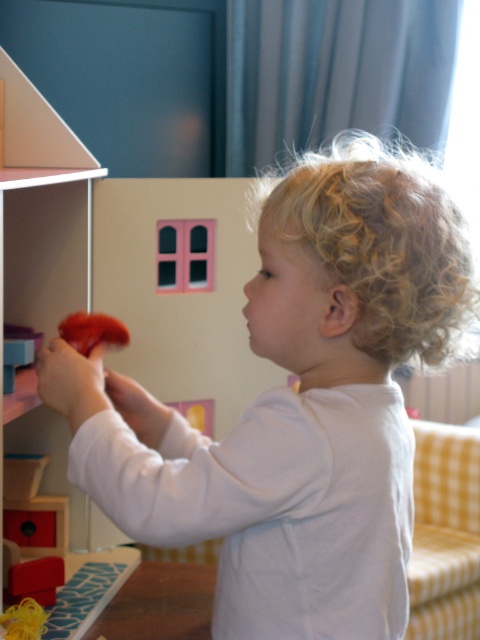
You are a robot trying to navigate to the point marked as point (x=87, y=320). You are currently at point (x=290, y=220). According to the scene, which direction should you move to reach your destination?

Point (x=290, y=220) is in front of point (x=87, y=320), so you should move backward to reach point (x=87, y=320).

Where is the curly blonde hair at center located in the image?

The curly blonde hair at center is located at point (x=296, y=404) in the image.

The child has curly blonde hair at center and is holding a matte red toy at left. Which object is positioned higher in the image?

The matte red toy at left is positioned higher than the curly blonde hair at center.